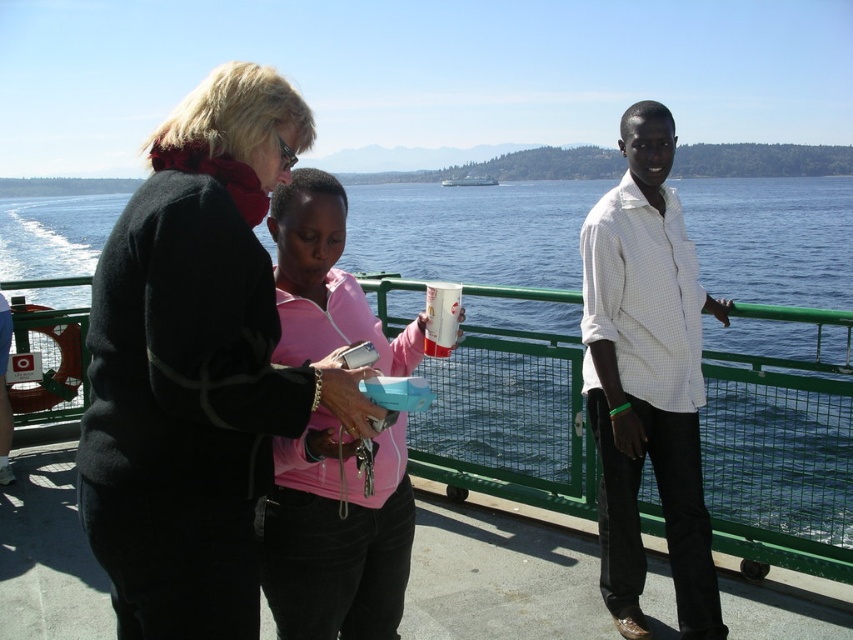
You are standing on the ferry deck and want to know if the green metal railing at center is wider than the white checkered shirt at center. Can you confirm this?

The green metal railing at center is wider than the white checkered shirt at center according to the description.

You are standing on the ferry deck and want to take a photo of the distant landmasses. To do this, you need to position yourself so that the matte black jacket at center is not blocking your view. Where should you move relative to the point marked at coordinates point (196, 365)?

The matte black jacket at center is located at point (196, 365). To avoid it blocking your view, you should move to a position either to the left or right of that point, ensuring the jacket is out of the frame.

You are a passenger on the ferry and want to place your white glossy cup at center on the green metal railing at center. Will the cup fit on the railing?

The green metal railing at center has a lesser width compared to white glossy cup at center, so the cup will not fit on the railing because the railing is narrower than the cup.